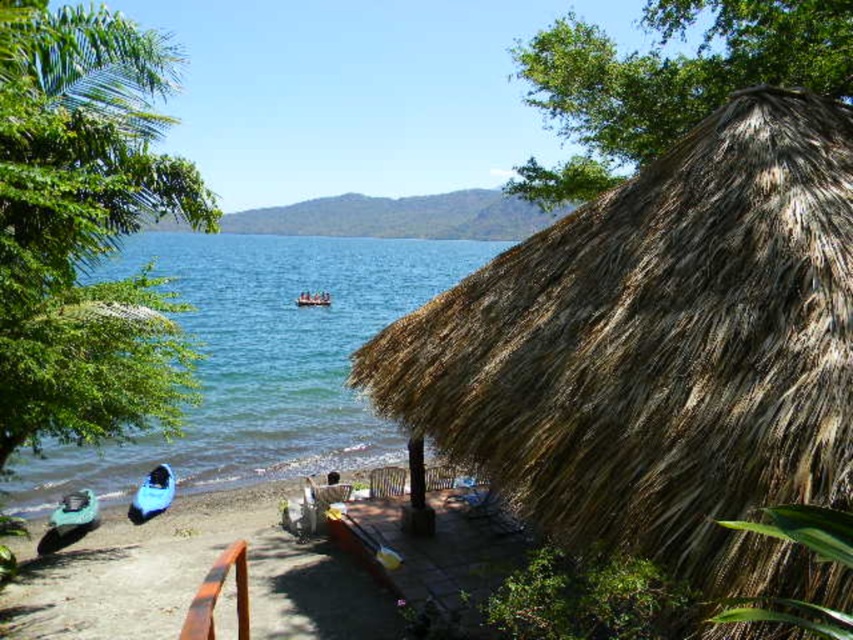
Question: Is green leafy tree at left positioned at the back of blue fabric boat at center?

Choices:
 (A) yes
 (B) no

Answer: (B)

Question: Based on their relative distances, which object is nearer to the blue water at center?

Choices:
 (A) blue plastic boat at lower left
 (B) teal rubber kayak at lower left
 (C) brown thatch hut at right

Answer: (C)

Question: Is green leafy tree at upper right above blue fabric boat at center?

Choices:
 (A) no
 (B) yes

Answer: (B)

Question: Considering the relative positions of blue water at center and blue plastic boat at lower left in the image provided, where is blue water at center located with respect to blue plastic boat at lower left?

Choices:
 (A) above
 (B) below

Answer: (A)

Question: Which point is closer to the camera?

Choices:
 (A) (296, 300)
 (B) (13, 230)
 (C) (152, 513)

Answer: (B)

Question: Which point is farther from the camera taking this photo?

Choices:
 (A) (312, 305)
 (B) (766, 275)

Answer: (A)